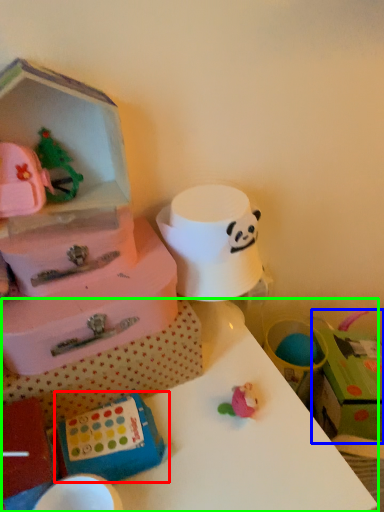
Question: Which object is the closest to the box (highlighted by a red box)? Choose among these: storage box (highlighted by a blue box) or table (highlighted by a green box).

Choices:
 (A) storage box
 (B) table

Answer: (B)